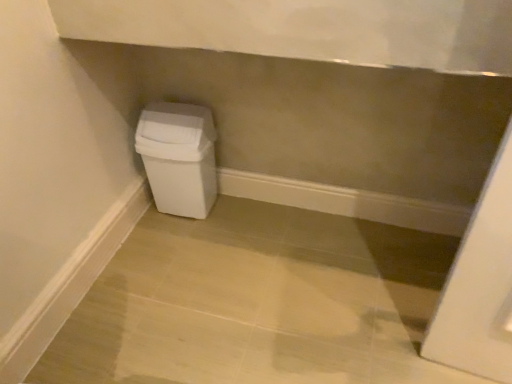
The width and height of the screenshot is (512, 384). I want to click on free spot to the right of white plastic waste bin at lower left, so click(242, 210).